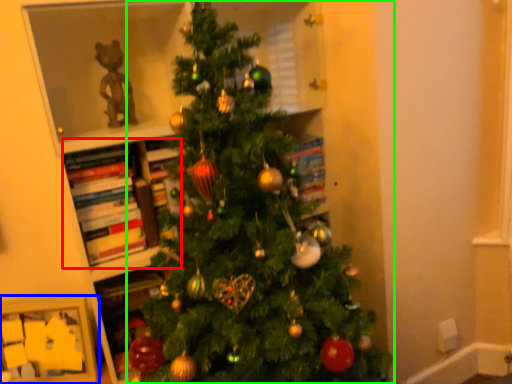
Question: Based on their relative distances, which object is farther from book (highlighted by a red box)? Choose from picture frame (highlighted by a blue box) and christmas tree (highlighted by a green box).

Choices:
 (A) picture frame
 (B) christmas tree

Answer: (B)